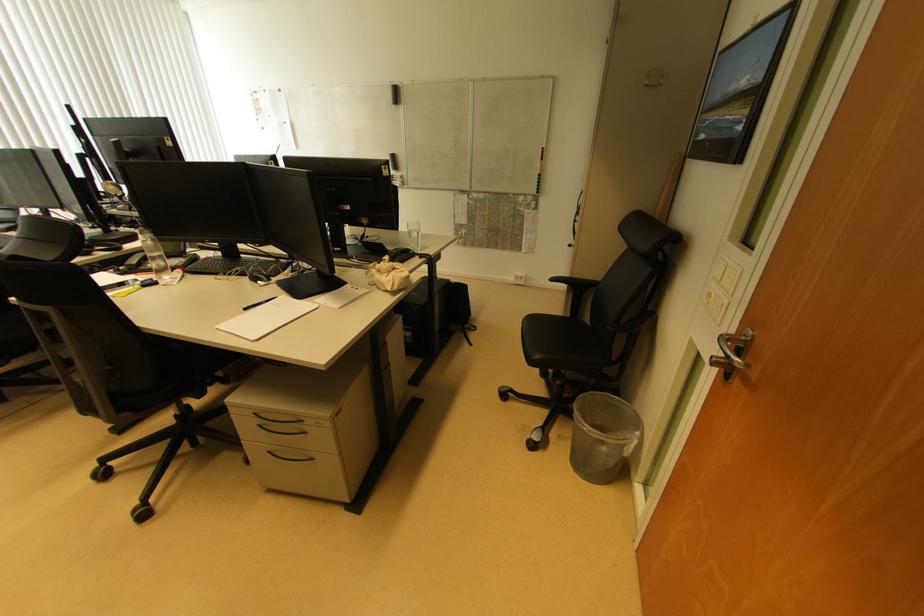
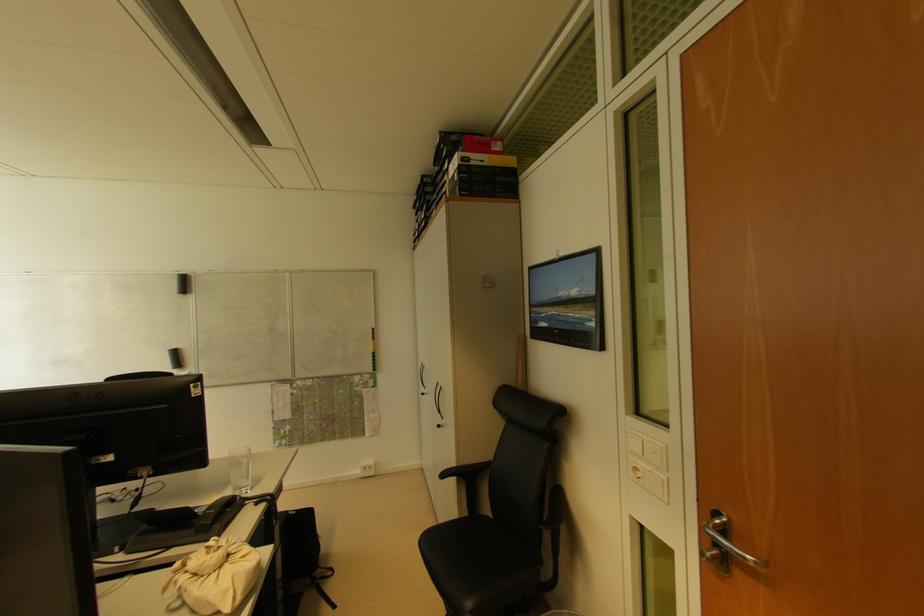
The point at (590,328) is marked in the first image. Where is the corresponding point in the second image?

(493, 520)